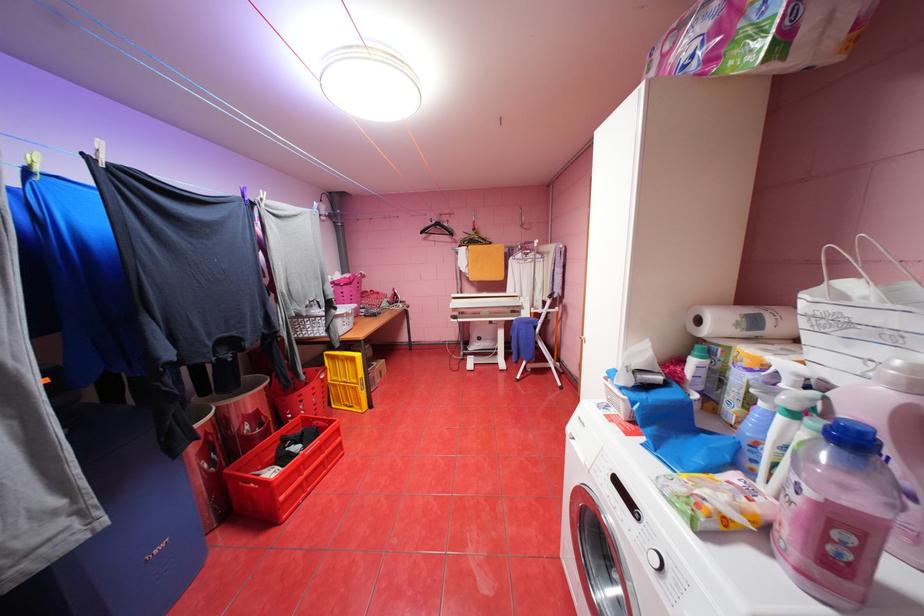
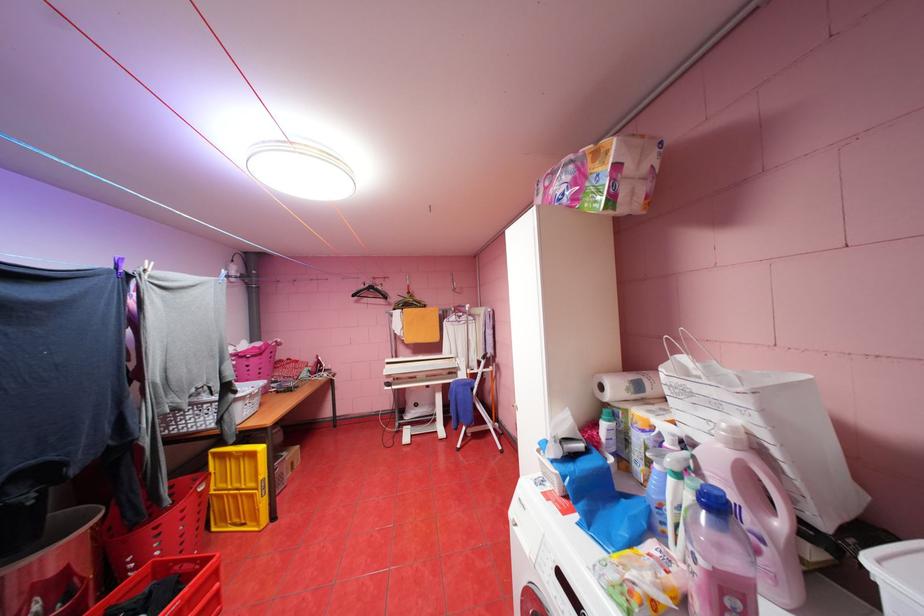
Where in the second image is the point corresponding to (x=311, y=377) from the first image?

(176, 501)